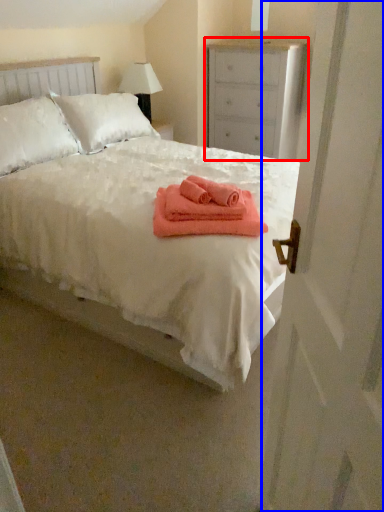
Question: Which object is closer to the camera taking this photo, chest of drawers (highlighted by a red box) or screen door (highlighted by a blue box)?

Choices:
 (A) chest of drawers
 (B) screen door

Answer: (B)